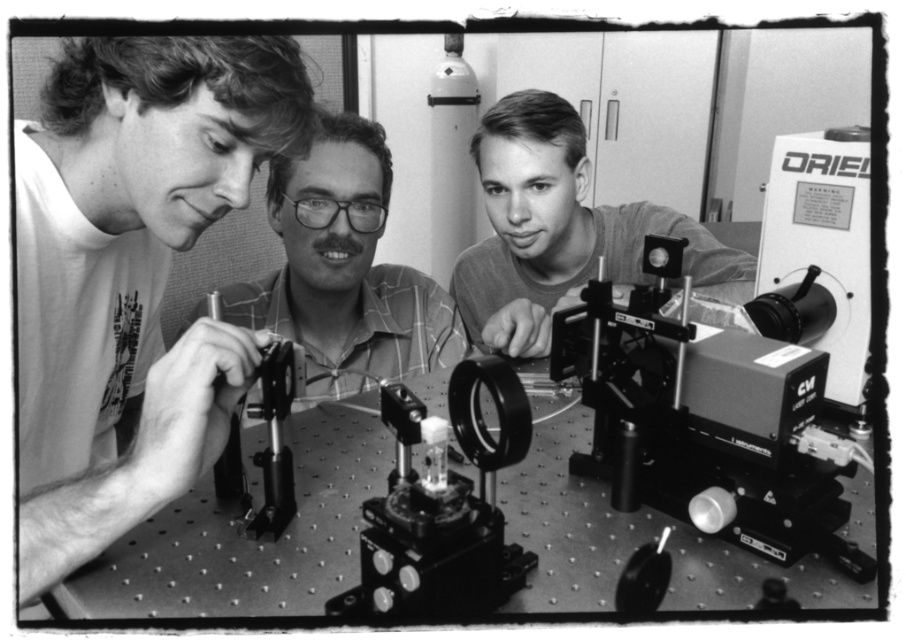
In the scene shown: You are a new intern in the lab and need to locate the metallic silver lens at lower right. From your vantage point, where would you look relative to the matte white shirt at left?

The metallic silver lens at lower right is located below the matte white shirt at left.